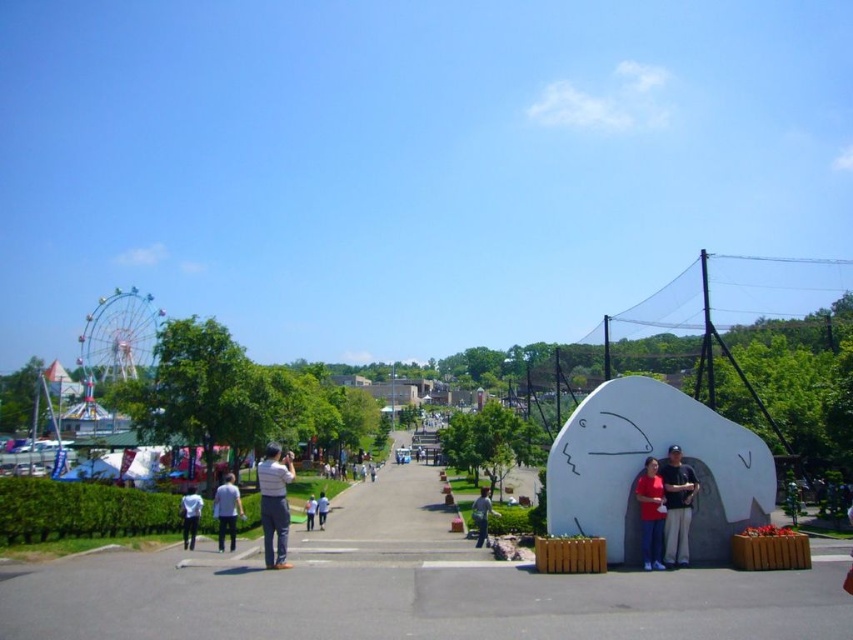
You are a photographer trying to capture a clear shot of the light blue shirt at center and the light blue denim jeans at center. Since both are light blue, you want to ensure the viewer can distinguish between them. What visual cue can you use to help differentiate these two items in the photo?

The light blue shirt at center is closer to the viewer than the light blue denim jeans at center, so the shirt will appear larger and more detailed compared to the jeans, making them distinguishable.

You are a photographer standing at the entrance of the fairground. You want to take a photo of the matte white statue at lower right without including the Ferris wheel in the background. The camera you are using has a maximum zoom range of 10 meters. Can you capture the statue without the Ferris wheel appearing in the shot?

The matte white statue at lower right is 18.15 meters away from the camera. Since the camera can only zoom up to 10 meters, you cannot capture the statue without the Ferris wheel appearing in the background.